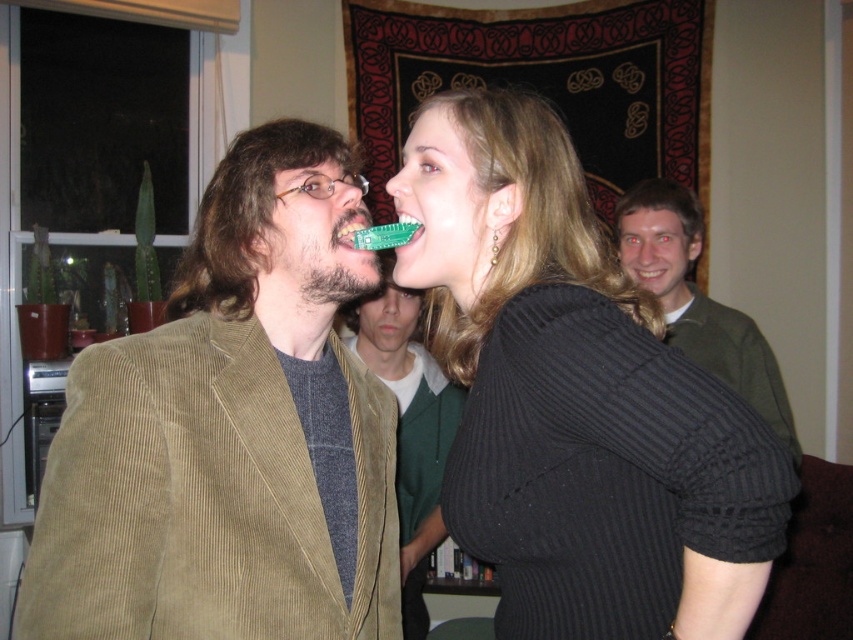
Does green corduroy jacket at center have a smaller size compared to green corduroy jacket at upper right?

Incorrect, green corduroy jacket at center is not smaller in size than green corduroy jacket at upper right.

Measure the distance between green corduroy jacket at center and camera.

The distance of green corduroy jacket at center from camera is 1.86 meters.

This screenshot has width=853, height=640. I want to click on green corduroy jacket at center, so click(x=409, y=426).

Locate an element on the screen. The height and width of the screenshot is (640, 853). green corduroy jacket at center is located at coordinates (409, 426).

Identify the location of beige corduroy blazer at left. (231, 433).

Which is more to the right, beige corduroy blazer at left or black ribbed sweater at center?

black ribbed sweater at center

Which is behind, point (358, 509) or point (549, 609)?

The point (358, 509) is behind.

What are the coordinates of `beige corduroy blazer at left` in the screenshot? It's located at (231, 433).

In the scene shown: Between beige corduroy blazer at left and green corduroy jacket at upper right, which one is positioned lower?

Positioned lower is beige corduroy blazer at left.

Which is behind, point (218, 385) or point (752, 339)?

The point (752, 339) is more distant.

Image resolution: width=853 pixels, height=640 pixels. What are the coordinates of `beige corduroy blazer at left` in the screenshot? It's located at (231, 433).